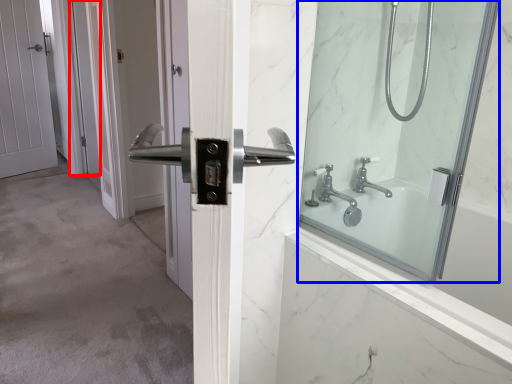
Question: Among these objects, which one is nearest to the camera, screen door (highlighted by a red box) or mirror (highlighted by a blue box)?

Choices:
 (A) screen door
 (B) mirror

Answer: (B)